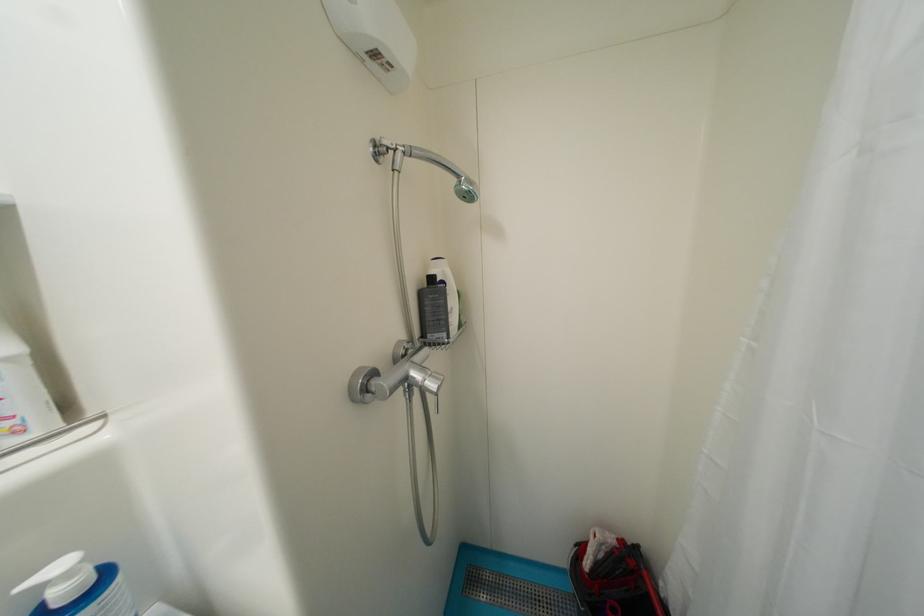
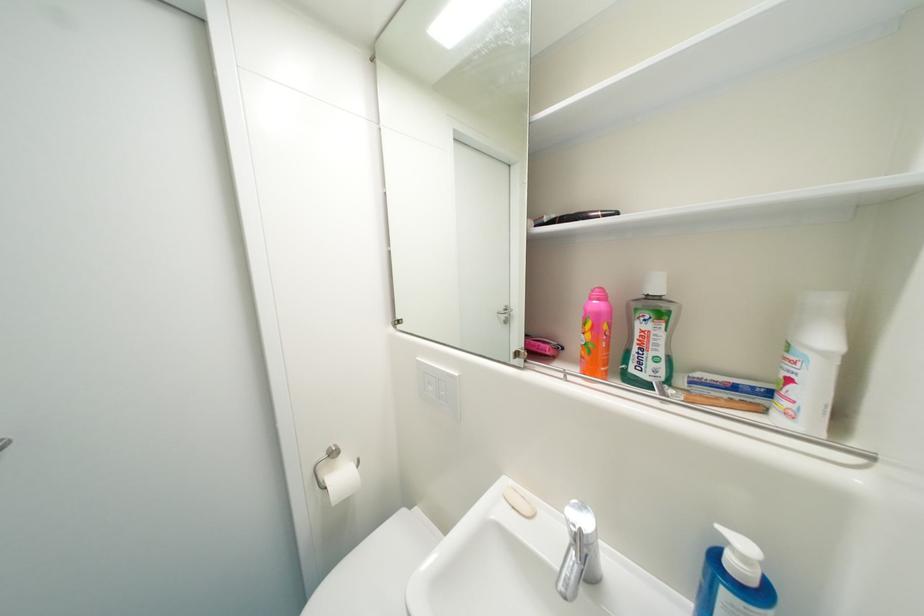
In the scene shown: How did the camera likely rotate?

The camera's rotation is toward left-down.